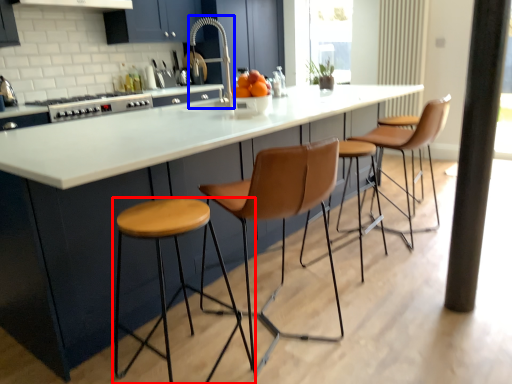
Question: Which point is further to the camera, stool (highlighted by a red box) or faucet (highlighted by a blue box)?

Choices:
 (A) stool
 (B) faucet

Answer: (B)